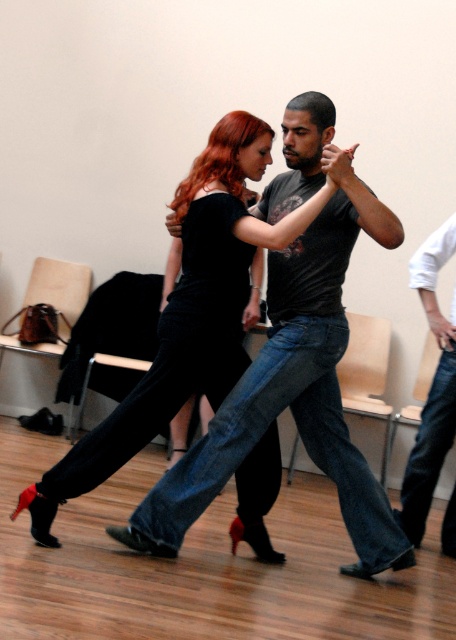
Can you confirm if velvet black dress at center is smaller than jeans at right?

Actually, velvet black dress at center might be larger than jeans at right.

Between velvet black dress at center and jeans at right, which one is positioned lower?

jeans at right is below.

Locate an element on the screen. The image size is (456, 640). velvet black dress at center is located at coordinates [x=186, y=314].

You are a GUI agent. You are given a task and a screenshot of the screen. Output one action in this format:
    pyautogui.click(x=<x>, y=<y>)
    Task: Click on the velvet black dress at center
    The height and width of the screenshot is (640, 456).
    Given the screenshot: What is the action you would take?
    pyautogui.click(x=186, y=314)